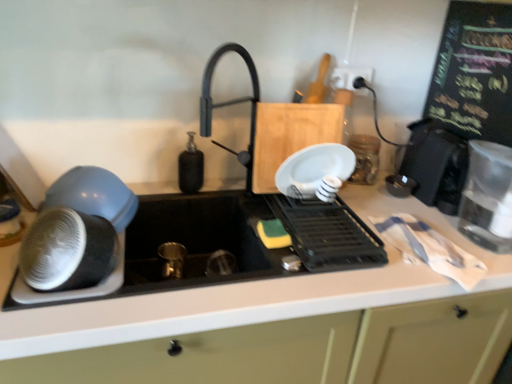
Where is `vacant area to the left of black plastic toaster at right, the 4th appliance positioned from the left`? vacant area to the left of black plastic toaster at right, the 4th appliance positioned from the left is located at coordinates (374, 200).